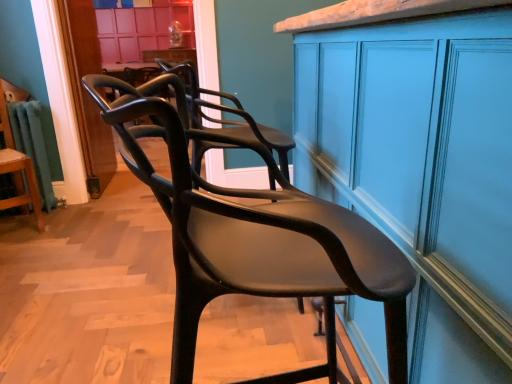
Question: Should I look upward or downward to see matte black chair at center, the second chair in the back-to-front sequence?

Choices:
 (A) down
 (B) up

Answer: (A)

Question: Considering the relative sizes of matte black chair at left, the 1th chair from the back, and matte blue cabinet at center in the image provided, is matte black chair at left, the 1th chair from the back, bigger than matte blue cabinet at center?

Choices:
 (A) no
 (B) yes

Answer: (A)

Question: From the image's perspective, does matte black chair at left, marked as the second chair in a right-to-left arrangement, appear higher than matte blue cabinet at center?

Choices:
 (A) no
 (B) yes

Answer: (B)

Question: Is matte black chair at left, which is counted as the first chair, starting from the left, taller than matte blue cabinet at center?

Choices:
 (A) no
 (B) yes

Answer: (A)

Question: Is matte black chair at left, marked as the second chair in a right-to-left arrangement, at the left side of matte blue cabinet at center?

Choices:
 (A) no
 (B) yes

Answer: (B)

Question: Is matte black chair at left, which is counted as the first chair, starting from the left, facing away from matte blue cabinet at center?

Choices:
 (A) yes
 (B) no

Answer: (B)

Question: From a real-world perspective, is matte black chair at left, which is counted as the first chair, starting from the left, located higher than matte blue cabinet at center?

Choices:
 (A) no
 (B) yes

Answer: (A)

Question: Does matte blue cabinet at center have a lesser width compared to matte black chair at left, arranged as the 2th chair when viewed from the front?

Choices:
 (A) yes
 (B) no

Answer: (B)

Question: From the image's perspective, is matte blue cabinet at center beneath matte black chair at left, which is counted as the first chair, starting from the left?

Choices:
 (A) yes
 (B) no

Answer: (A)

Question: Does matte blue cabinet at center appear on the right side of matte black chair at left, which is counted as the first chair, starting from the left?

Choices:
 (A) no
 (B) yes

Answer: (B)

Question: Can you confirm if matte blue cabinet at center is smaller than matte black chair at left, arranged as the 2th chair when viewed from the front?

Choices:
 (A) yes
 (B) no

Answer: (B)

Question: Is matte blue cabinet at center located outside matte black chair at left, the 1th chair from the back?

Choices:
 (A) yes
 (B) no

Answer: (A)

Question: From the image's perspective, is matte blue cabinet at center on top of matte black chair at left, marked as the second chair in a right-to-left arrangement?

Choices:
 (A) no
 (B) yes

Answer: (A)

Question: Is matte black chair at left, marked as the second chair in a right-to-left arrangement, at the right side of matte black chair at center, positioned as the first chair in right-to-left order?

Choices:
 (A) no
 (B) yes

Answer: (A)